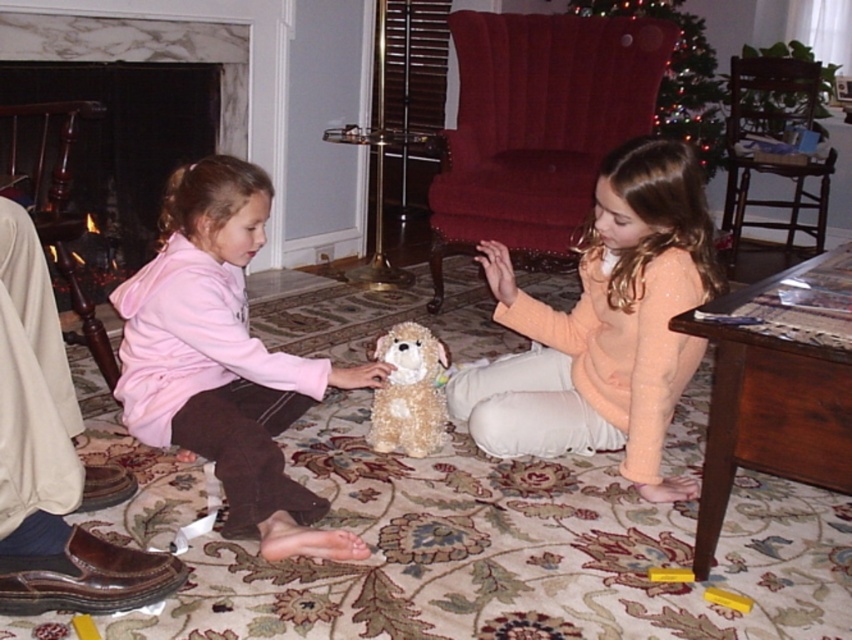
Between pink fleece sweater at lower left and wooden armchair at left, which one has less height?

pink fleece sweater at lower left

Describe the element at coordinates (223, 360) in the screenshot. Image resolution: width=852 pixels, height=640 pixels. I see `pink fleece sweater at lower left` at that location.

Where is `pink fleece sweater at lower left`? The image size is (852, 640). pink fleece sweater at lower left is located at coordinates (223, 360).

Identify the location of pink fleece sweater at lower left. (223, 360).

Looking at this image, which of these two, wooden armchair at left or shiny green christmas tree at upper center, stands shorter?

wooden armchair at left

Is wooden armchair at left wider than shiny green christmas tree at upper center?

In fact, wooden armchair at left might be narrower than shiny green christmas tree at upper center.

Is point (68, 257) in front of point (674, 100)?

Yes, it is.

At what (x,y) coordinates should I click in order to perform the action: click on wooden armchair at left. Please return your answer as a coordinate pair (x, y). Looking at the image, I should click on (61, 212).

Is matte peach sweater at center positioned before wooden armchair at left?

That is True.

Is matte peach sweater at center further to the viewer compared to wooden armchair at left?

That is False.

Which is behind, point (635, 196) or point (56, 113)?

Point (56, 113)

The height and width of the screenshot is (640, 852). Identify the location of matte peach sweater at center. (603, 324).